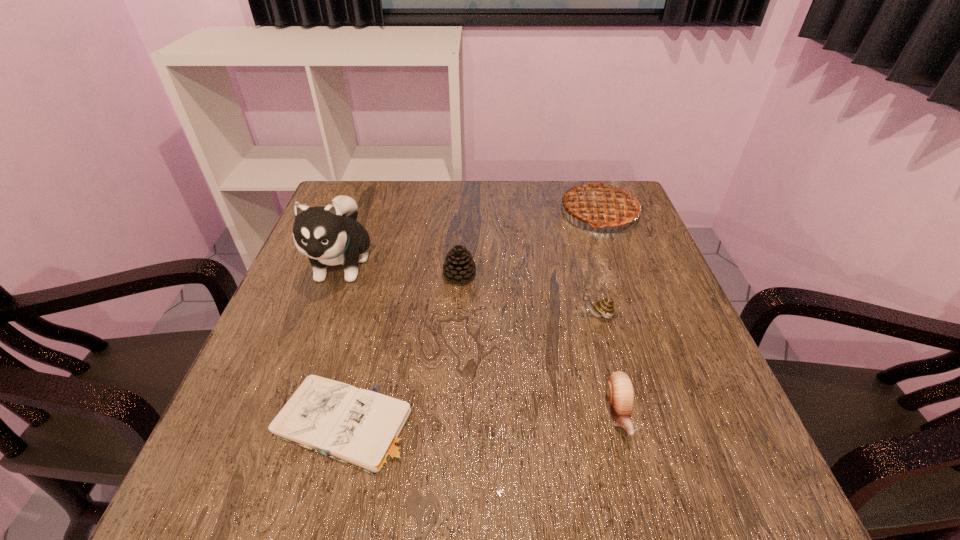
Locate an element on the screen. empty space that is in between the nearer escargot and the farther escargot is located at coordinates (608, 364).

The width and height of the screenshot is (960, 540). Identify the location of vacant area between the pinecone and the farther escargot. (528, 295).

Locate an element on the screen. vacant area between the third object from left to right and the shorter escargot is located at coordinates (540, 345).

Locate an element on the screen. The width and height of the screenshot is (960, 540). free spot between the fourth object from right to left and the second shortest object is located at coordinates (540, 345).

Locate an element on the screen. vacant space that is in between the notebook and the pie is located at coordinates (470, 319).

Find the location of `free space between the pinecone and the puppy`. free space between the pinecone and the puppy is located at coordinates (400, 269).

Image resolution: width=960 pixels, height=540 pixels. I want to click on empty location between the notebook and the fourth farthest object, so click(x=469, y=369).

Image resolution: width=960 pixels, height=540 pixels. I want to click on free space between the pie and the puppy, so click(x=470, y=238).

Where is `empty space that is in between the pinecone and the shorter escargot`? Image resolution: width=960 pixels, height=540 pixels. empty space that is in between the pinecone and the shorter escargot is located at coordinates (540, 345).

Where is `object that ranks as the fourth closest to the second tallest object`? object that ranks as the fourth closest to the second tallest object is located at coordinates (330, 235).